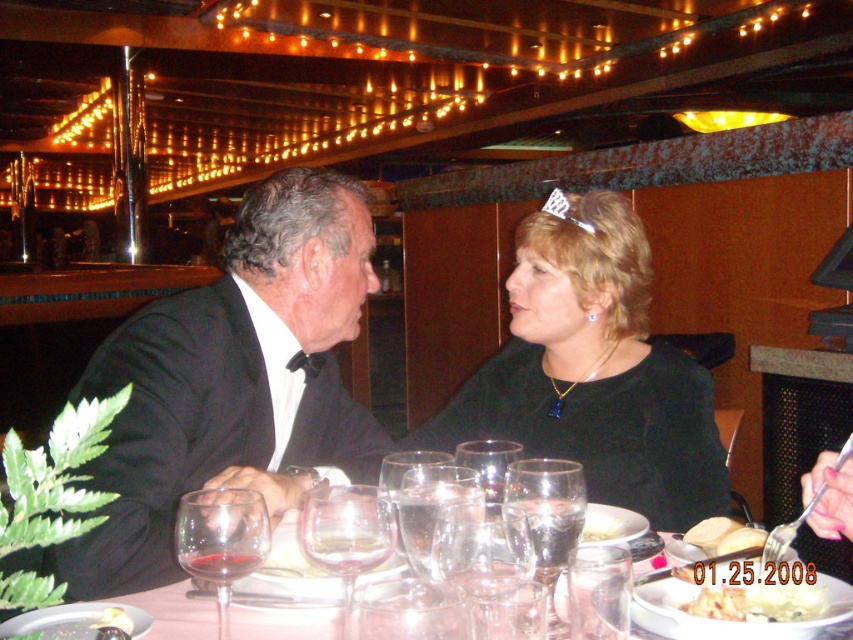
Question: Which point appears farthest from the camera in this image?

Choices:
 (A) (215, 632)
 (B) (190, 560)

Answer: (A)

Question: Can you confirm if clear glass wine glass at center is positioned to the left of translucent glass wine at center?

Choices:
 (A) yes
 (B) no

Answer: (B)

Question: Is ruby glass at center positioned behind white bread at lower right?

Choices:
 (A) yes
 (B) no

Answer: (B)

Question: Can you confirm if white bread at lower right is positioned to the left of silver metallic tiara at upper center?

Choices:
 (A) yes
 (B) no

Answer: (B)

Question: Which point appears farthest from the camera in this image?

Choices:
 (A) (486, 614)
 (B) (416, 492)
 (C) (320, 525)

Answer: (B)

Question: Which object appears farthest from the camera in this image?

Choices:
 (A) black matte dress at center
 (B) translucent glass wine at center
 (C) white bread at center

Answer: (A)